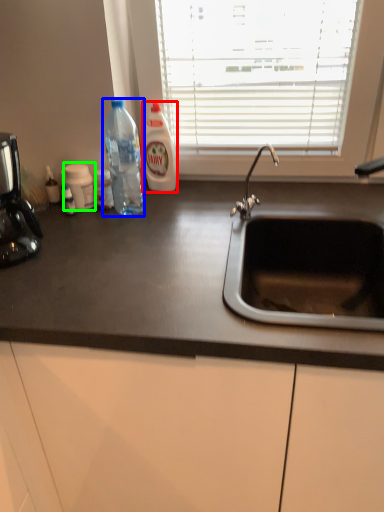
Question: Estimate the real-world distances between objects in this image. Which object is closer to cleaning product (highlighted by a red box), bottle (highlighted by a blue box) or bottle (highlighted by a green box)?

Choices:
 (A) bottle
 (B) bottle

Answer: (A)